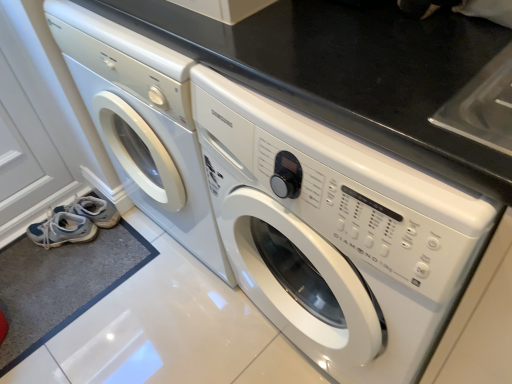
What is the approximate width of light blue fabric shoe at lower left, which is the first shoe from bottom to top?

light blue fabric shoe at lower left, which is the first shoe from bottom to top, is 26.63 centimeters wide.

The image size is (512, 384). What are the coordinates of `white glossy washing machine at center, which ranks as the first washing machine in left-to-right order` in the screenshot? It's located at pyautogui.click(x=143, y=123).

Is white glossy washing machine at center, the 1th washing machine positioned from the right, thinner than light blue fabric shoe at lower left, which is the first shoe from bottom to top?

No, white glossy washing machine at center, the 1th washing machine positioned from the right, is not thinner than light blue fabric shoe at lower left, which is the first shoe from bottom to top.

From the image's perspective, which object appears higher, white glossy washing machine at center, the 1th washing machine positioned from the right, or light blue fabric shoe at lower left, which is the first shoe from bottom to top?

From the image's view, white glossy washing machine at center, the 1th washing machine positioned from the right, is above.

Looking at this image, from a real-world perspective, is white glossy washing machine at center, the 1th washing machine positioned from the right, under light blue fabric shoe at lower left, which is the first shoe from bottom to top?

Actually, white glossy washing machine at center, the 1th washing machine positioned from the right, is physically above light blue fabric shoe at lower left, which is the first shoe from bottom to top, in the real world.

Could you tell me if white glossy washing machine at center, acting as the 2th washing machine starting from the left, is turned towards light blue fabric shoe at lower left, which is the first shoe from bottom to top?

No, white glossy washing machine at center, acting as the 2th washing machine starting from the left, is not facing towards light blue fabric shoe at lower left, which is the first shoe from bottom to top.

In the scene shown: Which of these two, white fabric shoe at lower left, which is the 2th shoe in bottom-to-top order, or white glossy washing machine at center, the 1th washing machine positioned from the right, is bigger?

white glossy washing machine at center, the 1th washing machine positioned from the right, is bigger.

From the image's perspective, which is above, white fabric shoe at lower left, the 1th shoe from the top, or white glossy washing machine at center, the 1th washing machine positioned from the right?

white glossy washing machine at center, the 1th washing machine positioned from the right, appears higher in the image.

Is white fabric shoe at lower left, which is the 2th shoe in bottom-to-top order, inside the boundaries of white glossy washing machine at center, acting as the 2th washing machine starting from the left, or outside?

white fabric shoe at lower left, which is the 2th shoe in bottom-to-top order, is spatially situated outside white glossy washing machine at center, acting as the 2th washing machine starting from the left.

From the image's perspective, which one is positioned higher, white glossy washing machine at center, acting as the 2th washing machine starting from the left, or white fabric shoe at lower left, the 1th shoe from the top?

white glossy washing machine at center, acting as the 2th washing machine starting from the left, from the image's perspective.

Between white glossy washing machine at center, acting as the 2th washing machine starting from the left, and white fabric shoe at lower left, the 1th shoe from the top, which one has larger size?

With larger size is white glossy washing machine at center, acting as the 2th washing machine starting from the left.

Between point (313, 169) and point (98, 208), which one is positioned behind?

The point (98, 208) is farther from the camera.

Considering the sizes of white glossy washing machine at center, acting as the 2th washing machine starting from the left, and white fabric shoe at lower left, the 1th shoe from the top, in the image, is white glossy washing machine at center, acting as the 2th washing machine starting from the left, wider or thinner than white fabric shoe at lower left, the 1th shoe from the top,?

In the image, white glossy washing machine at center, acting as the 2th washing machine starting from the left, appears to be wider than white fabric shoe at lower left, the 1th shoe from the top.

From the image's perspective, is white glossy washing machine at center, the 1th washing machine positioned from the right, located above or below white glossy washing machine at center, the second washing machine viewed from the right?

Based on their image positions, white glossy washing machine at center, the 1th washing machine positioned from the right, is located beneath white glossy washing machine at center, the second washing machine viewed from the right.

In terms of size, does white glossy washing machine at center, the 1th washing machine positioned from the right, appear bigger or smaller than white glossy washing machine at center, the second washing machine viewed from the right?

In the image, white glossy washing machine at center, the 1th washing machine positioned from the right, appears to be smaller than white glossy washing machine at center, the second washing machine viewed from the right.

How far apart are white glossy washing machine at center, the 1th washing machine positioned from the right, and white glossy washing machine at center, the second washing machine viewed from the right?

white glossy washing machine at center, the 1th washing machine positioned from the right, is 12.80 inches from white glossy washing machine at center, the second washing machine viewed from the right.

Are white glossy washing machine at center, acting as the 2th washing machine starting from the left, and white glossy washing machine at center, the second washing machine viewed from the right, far apart?

white glossy washing machine at center, acting as the 2th washing machine starting from the left, is near white glossy washing machine at center, the second washing machine viewed from the right, not far away.

Would you say light blue fabric shoe at lower left, the 2th shoe viewed from the top, is a long distance from white glossy washing machine at center, the second washing machine viewed from the right?

They are positioned close to each other.

Does light blue fabric shoe at lower left, the 2th shoe viewed from the top, contain white glossy washing machine at center, the second washing machine viewed from the right?

That's incorrect, white glossy washing machine at center, the second washing machine viewed from the right, is not inside light blue fabric shoe at lower left, the 2th shoe viewed from the top.

In terms of height, does light blue fabric shoe at lower left, which is the first shoe from bottom to top, look taller or shorter compared to white glossy washing machine at center, the second washing machine viewed from the right?

Clearly, light blue fabric shoe at lower left, which is the first shoe from bottom to top, is shorter compared to white glossy washing machine at center, the second washing machine viewed from the right.

Is light blue fabric shoe at lower left, the 2th shoe viewed from the top, wider or thinner than white glossy washing machine at center, the second washing machine viewed from the right?

light blue fabric shoe at lower left, the 2th shoe viewed from the top, is thinner than white glossy washing machine at center, the second washing machine viewed from the right.

Could you tell me if white glossy washing machine at center, the second washing machine viewed from the right, is facing white fabric shoe at lower left, the 1th shoe from the top?

No, white glossy washing machine at center, the second washing machine viewed from the right, is not facing towards white fabric shoe at lower left, the 1th shoe from the top.

Can you confirm if white glossy washing machine at center, which ranks as the first washing machine in left-to-right order, is taller than white fabric shoe at lower left, the 1th shoe from the top?

Yes.

Relative to white fabric shoe at lower left, which is the 2th shoe in bottom-to-top order, is white glossy washing machine at center, the second washing machine viewed from the right, in front or behind?

white glossy washing machine at center, the second washing machine viewed from the right, is positioned closer to the viewer than white fabric shoe at lower left, which is the 2th shoe in bottom-to-top order.

Is white fabric shoe at lower left, which is the 2th shoe in bottom-to-top order, far away from light blue fabric shoe at lower left, the 2th shoe viewed from the top?

white fabric shoe at lower left, which is the 2th shoe in bottom-to-top order, is actually quite close to light blue fabric shoe at lower left, the 2th shoe viewed from the top.

From the image's perspective, would you say white fabric shoe at lower left, the 1th shoe from the top, is shown under light blue fabric shoe at lower left, the 2th shoe viewed from the top?

No.

Does white fabric shoe at lower left, which is the 2th shoe in bottom-to-top order, turn towards light blue fabric shoe at lower left, the 2th shoe viewed from the top?

No, white fabric shoe at lower left, which is the 2th shoe in bottom-to-top order, is not facing towards light blue fabric shoe at lower left, the 2th shoe viewed from the top.

Which object is wider, white fabric shoe at lower left, the 1th shoe from the top, or light blue fabric shoe at lower left, which is the first shoe from bottom to top?

white fabric shoe at lower left, the 1th shoe from the top.

From the image's perspective, starting from the light blue fabric shoe at lower left, which is the first shoe from bottom to top, which washing machine is the 1st one above? Please provide its 2D coordinates.

[(335, 233)]

From a real-world perspective, starting from the white glossy washing machine at center, acting as the 2th washing machine starting from the left, which shoe is the 2nd one below it? Please provide its 2D coordinates.

[(93, 211)]

From the image, which object appears to be farther from white glossy washing machine at center, the 1th washing machine positioned from the right, white glossy washing machine at center, the second washing machine viewed from the right, or white fabric shoe at lower left, the 1th shoe from the top?

white fabric shoe at lower left, the 1th shoe from the top, is further to white glossy washing machine at center, the 1th washing machine positioned from the right.

Looking at the image, which one is located closer to light blue fabric shoe at lower left, which is the first shoe from bottom to top, white glossy washing machine at center, the 1th washing machine positioned from the right, or white glossy washing machine at center, the second washing machine viewed from the right?

white glossy washing machine at center, the second washing machine viewed from the right, is closer to light blue fabric shoe at lower left, which is the first shoe from bottom to top.

From the picture: Which object lies further to the anchor point light blue fabric shoe at lower left, which is the first shoe from bottom to top, white glossy washing machine at center, the 1th washing machine positioned from the right, or white fabric shoe at lower left, which is the 2th shoe in bottom-to-top order?

Among the two, white glossy washing machine at center, the 1th washing machine positioned from the right, is located further to light blue fabric shoe at lower left, which is the first shoe from bottom to top.

When comparing their distances from white glossy washing machine at center, acting as the 2th washing machine starting from the left, does white fabric shoe at lower left, which is the 2th shoe in bottom-to-top order, or light blue fabric shoe at lower left, the 2th shoe viewed from the top, seem closer?

Based on the image, white fabric shoe at lower left, which is the 2th shoe in bottom-to-top order, appears to be nearer to white glossy washing machine at center, acting as the 2th washing machine starting from the left.

From the picture: When comparing their distances from white glossy washing machine at center, the second washing machine viewed from the right, does white fabric shoe at lower left, the 1th shoe from the top, or white glossy washing machine at center, acting as the 2th washing machine starting from the left, seem closer?

white glossy washing machine at center, acting as the 2th washing machine starting from the left.

When comparing their distances from light blue fabric shoe at lower left, which is the first shoe from bottom to top, does white glossy washing machine at center, which ranks as the first washing machine in left-to-right order, or white fabric shoe at lower left, which is the 2th shoe in bottom-to-top order, seem closer?

Based on the image, white fabric shoe at lower left, which is the 2th shoe in bottom-to-top order, appears to be nearer to light blue fabric shoe at lower left, which is the first shoe from bottom to top.

From the image, which object appears to be farther from white glossy washing machine at center, the second washing machine viewed from the right, white glossy washing machine at center, acting as the 2th washing machine starting from the left, or white fabric shoe at lower left, the 1th shoe from the top?

Among the two, white fabric shoe at lower left, the 1th shoe from the top, is located further to white glossy washing machine at center, the second washing machine viewed from the right.

In the scene shown: Estimate the real-world distances between objects in this image. Which object is further from white glossy washing machine at center, acting as the 2th washing machine starting from the left, white fabric shoe at lower left, the 1th shoe from the top, or white glossy washing machine at center, the second washing machine viewed from the right?

white fabric shoe at lower left, the 1th shoe from the top, is positioned further to the anchor white glossy washing machine at center, acting as the 2th washing machine starting from the left.

Identify the location of washing machine between light blue fabric shoe at lower left, the 2th shoe viewed from the top, and white glossy washing machine at center, the 1th washing machine positioned from the right. (143, 123).

Where is `washing machine between white glossy washing machine at center, the 1th washing machine positioned from the right, and white fabric shoe at lower left, the 1th shoe from the top, in the front-back direction`? This screenshot has width=512, height=384. washing machine between white glossy washing machine at center, the 1th washing machine positioned from the right, and white fabric shoe at lower left, the 1th shoe from the top, in the front-back direction is located at coordinates click(143, 123).

Where is `shoe between white glossy washing machine at center, acting as the 2th washing machine starting from the left, and white fabric shoe at lower left, which is the 2th shoe in bottom-to-top order, from front to back`? Image resolution: width=512 pixels, height=384 pixels. shoe between white glossy washing machine at center, acting as the 2th washing machine starting from the left, and white fabric shoe at lower left, which is the 2th shoe in bottom-to-top order, from front to back is located at coordinates (62, 230).

Locate an element on the screen. This screenshot has width=512, height=384. shoe located between white glossy washing machine at center, the second washing machine viewed from the right, and white fabric shoe at lower left, the 1th shoe from the top, in the depth direction is located at coordinates (62, 230).